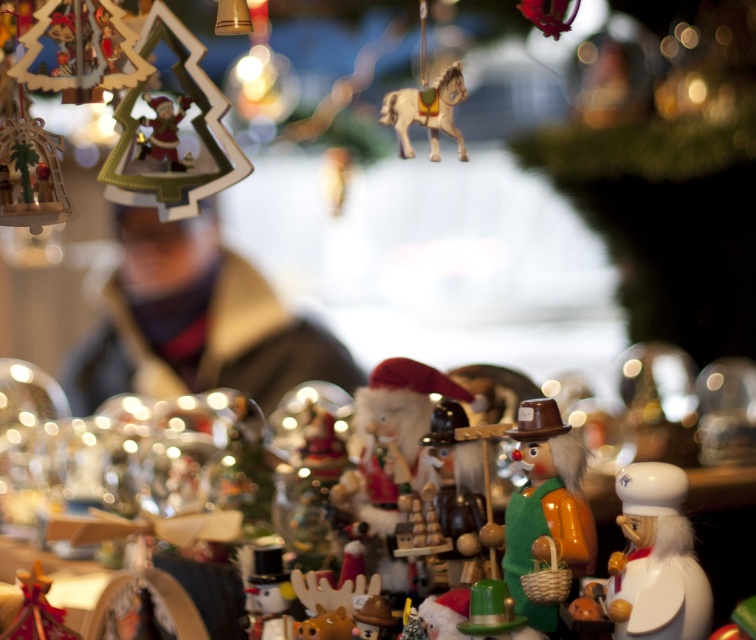
Who is positioned more to the left, white glossy nutcracker at lower right or matte plastic santa at upper left?

Positioned to the left is matte plastic santa at upper left.

Is white glossy nutcracker at lower right to the right of matte plastic santa at upper left from the viewer's perspective?

Yes, white glossy nutcracker at lower right is to the right of matte plastic santa at upper left.

What do you see at coordinates (655, 557) in the screenshot? Image resolution: width=756 pixels, height=640 pixels. I see `white glossy nutcracker at lower right` at bounding box center [655, 557].

Where is `white glossy nutcracker at lower right`? This screenshot has height=640, width=756. white glossy nutcracker at lower right is located at coordinates (655, 557).

Which is below, white glossy nutcracker at lower right or shiny gold horse at upper center?

white glossy nutcracker at lower right is lower down.

Is point (640, 524) closer to camera compared to point (435, 86)?

Yes, it is.

This screenshot has height=640, width=756. I want to click on white glossy nutcracker at lower right, so click(655, 557).

At what (x,y) coordinates should I click in order to perform the action: click on white glossy nutcracker at lower right. Please return your answer as a coordinate pair (x, y). The width and height of the screenshot is (756, 640). Looking at the image, I should click on (655, 557).

This screenshot has width=756, height=640. Identify the location of wooden clown at center. (547, 504).

Between wooden clown at center and shiny gold horse at upper center, which one appears on the right side from the viewer's perspective?

Positioned to the right is wooden clown at center.

The height and width of the screenshot is (640, 756). What do you see at coordinates (547, 504) in the screenshot?
I see `wooden clown at center` at bounding box center [547, 504].

Find the location of a particular element. Image resolution: width=756 pixels, height=640 pixels. wooden clown at center is located at coordinates (547, 504).